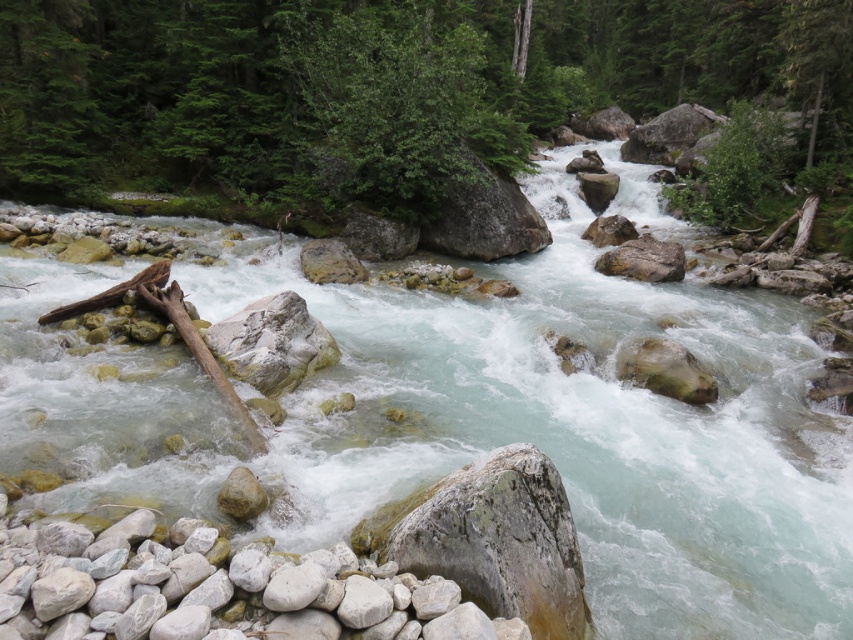
Does green leafy tree at center appear on the right side of smooth gray rock at center?

Correct, you'll find green leafy tree at center to the right of smooth gray rock at center.

Does green leafy tree at center appear on the left side of smooth gray rock at center?

In fact, green leafy tree at center is to the right of smooth gray rock at center.

Which is in front, point (426, 204) or point (247, 488)?

Point (247, 488) is more forward.

The height and width of the screenshot is (640, 853). In order to click on green leafy tree at center in this screenshot , I will do `click(386, 88)`.